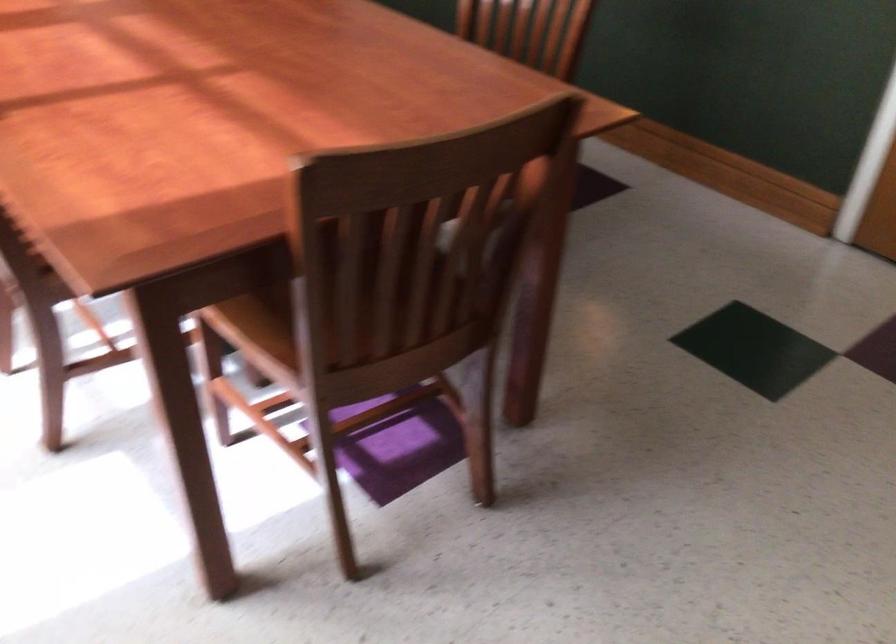
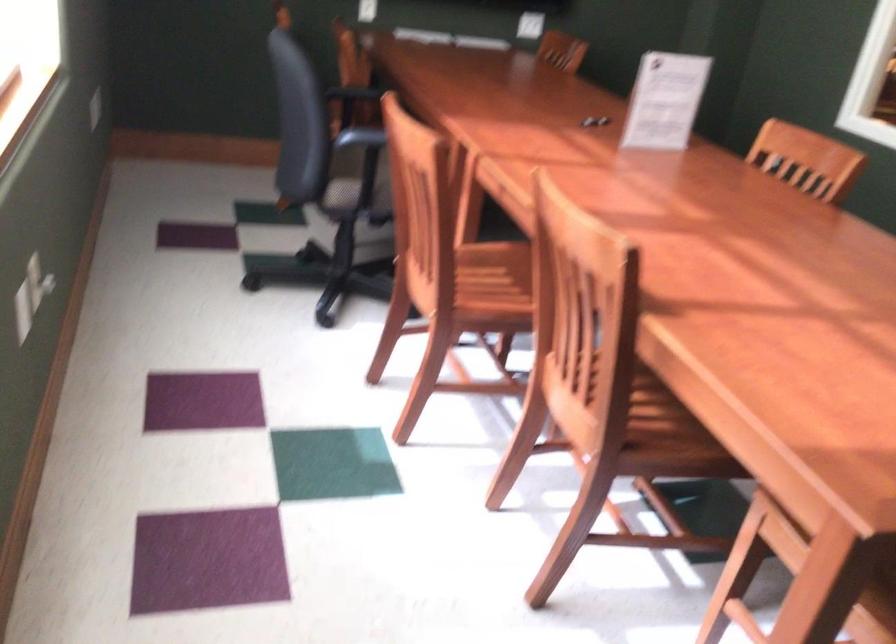
Question: Which direction would the cameraman need to move to produce the second image? Reply with the corresponding letter.

Choices:
 (A) Left
 (B) Right
 (C) Forward
 (D) Backward

Answer: (A)